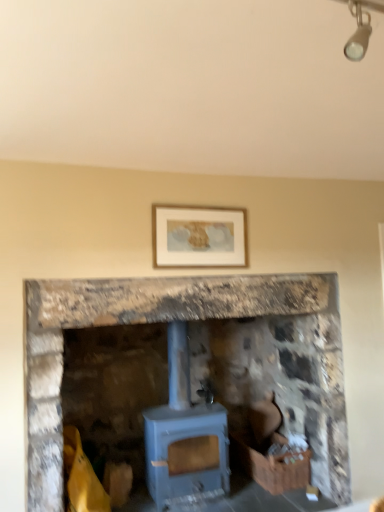
Question: Does brown leather chair at lower right have a lesser width compared to wooden crate at lower right?

Choices:
 (A) yes
 (B) no

Answer: (A)

Question: Is brown leather chair at lower right to the right of wooden crate at lower right from the viewer's perspective?

Choices:
 (A) yes
 (B) no

Answer: (A)

Question: Is brown leather chair at lower right in contact with wooden crate at lower right?

Choices:
 (A) yes
 (B) no

Answer: (B)

Question: Does brown leather chair at lower right have a lesser height compared to wooden crate at lower right?

Choices:
 (A) no
 (B) yes

Answer: (A)

Question: Is brown leather chair at lower right positioned behind wooden crate at lower right?

Choices:
 (A) yes
 (B) no

Answer: (A)

Question: From a real-world perspective, is brown leather chair at lower right positioned under wooden crate at lower right based on gravity?

Choices:
 (A) no
 (B) yes

Answer: (A)

Question: Is brown leather chair at lower right beside blue matte wood burning stove at center?

Choices:
 (A) yes
 (B) no

Answer: (B)

Question: Could you tell me if brown leather chair at lower right is turned towards blue matte wood burning stove at center?

Choices:
 (A) no
 (B) yes

Answer: (A)

Question: Is the position of brown leather chair at lower right less distant than that of blue matte wood burning stove at center?

Choices:
 (A) no
 (B) yes

Answer: (A)

Question: Is brown leather chair at lower right looking in the opposite direction of blue matte wood burning stove at center?

Choices:
 (A) no
 (B) yes

Answer: (A)

Question: From the image's perspective, is brown leather chair at lower right over blue matte wood burning stove at center?

Choices:
 (A) no
 (B) yes

Answer: (A)

Question: Is brown leather chair at lower right positioned far away from blue matte wood burning stove at center?

Choices:
 (A) yes
 (B) no

Answer: (B)

Question: Are blue matte wood burning stove at center and wooden crate at lower right far apart?

Choices:
 (A) no
 (B) yes

Answer: (A)